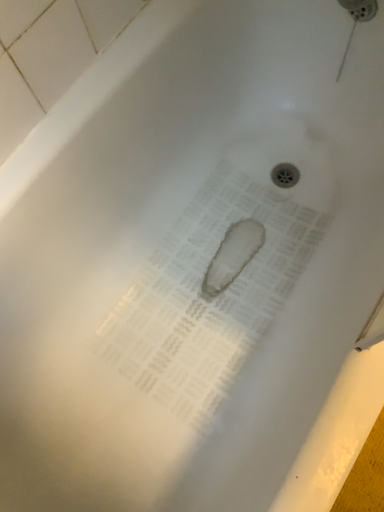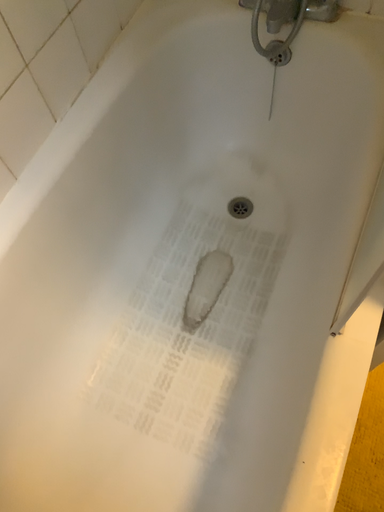
Question: Which way did the camera rotate in the video?

Choices:
 (A) rotated upward
 (B) rotated downward

Answer: (A)